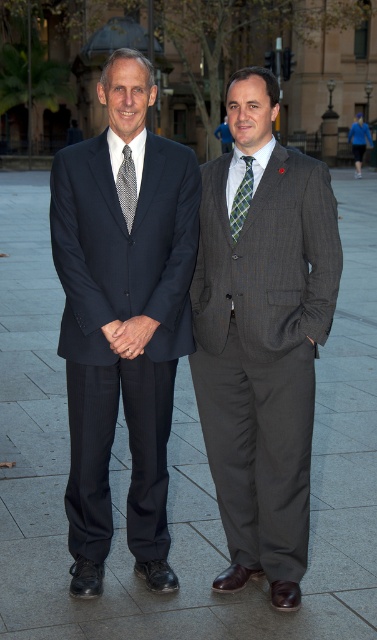
Question: Is navy pinstripe suit at left above green plaid tie at center?

Choices:
 (A) no
 (B) yes

Answer: (A)

Question: Does patterned silk tie at center have a larger size compared to green plaid tie at center?

Choices:
 (A) no
 (B) yes

Answer: (A)

Question: Is navy pinstripe suit at left smaller than patterned silk tie at center?

Choices:
 (A) yes
 (B) no

Answer: (B)

Question: Which point is farther to the camera?

Choices:
 (A) (64, 243)
 (B) (231, 236)

Answer: (B)

Question: Which point is farther to the camera?

Choices:
 (A) navy pinstripe suit at left
 (B) gray pinstripe suit at right
 (C) matte black suit at center
 (D) patterned silk tie at center

Answer: (D)

Question: Among these objects, which one is nearest to the camera?

Choices:
 (A) patterned silk tie at center
 (B) green plaid tie at center

Answer: (A)